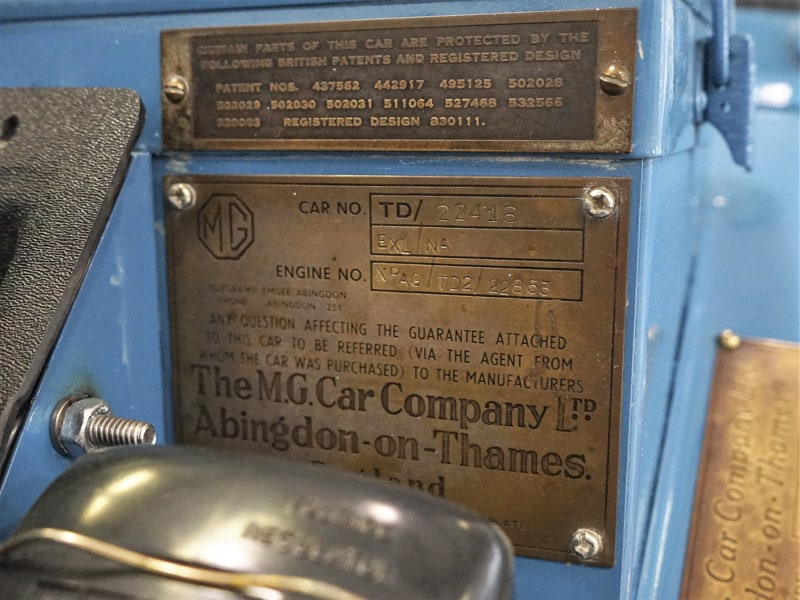
The width and height of the screenshot is (800, 600). I want to click on brass placard, so [x=556, y=121], [x=533, y=218], [x=744, y=387].